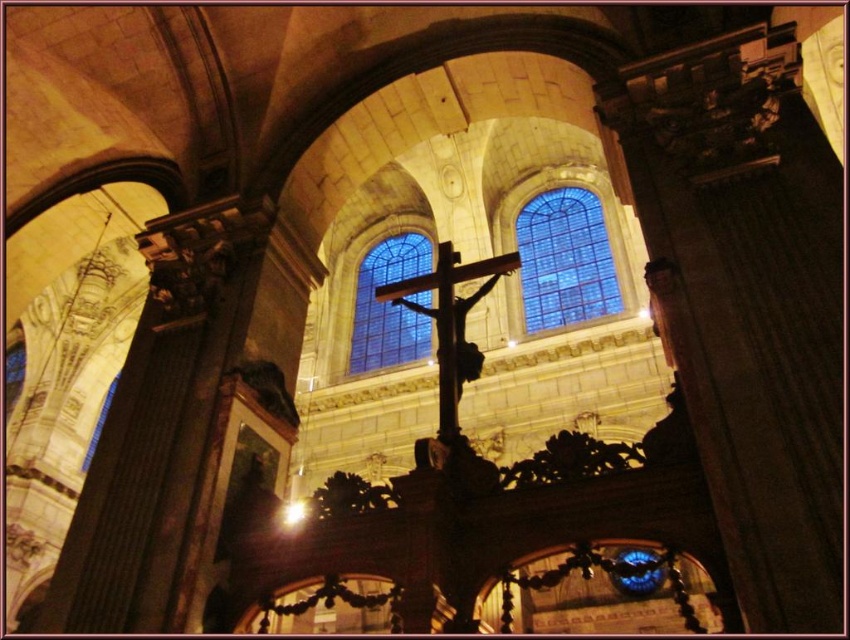
You are an architect examining the cathedral. You notice the blue stained glass at upper center and the blue glass window at center. Which one is positioned higher in the cathedral?

The blue stained glass at upper center is positioned higher than the blue glass window at center.

You are standing in the cathedral and want to take a photo of both the blue glass window at center and the metallic gold crucifix at center. Since you can only focus on one object at a time, which one should you aim the camera at first to ensure both are in the frame?

The blue glass window at center is positioned on the left side of metallic gold crucifix at center, so you should aim the camera at the metallic gold cruciff at center first to ensure both are in the frame.

Consider the image. You are an architect analyzing the cathedral design. You notice the blue stained glass at upper center and the metallic gold crucifix at center. Which object takes up more visual space in the image?

The metallic gold crucifix at center takes up more visual space than the blue stained glass at upper center.